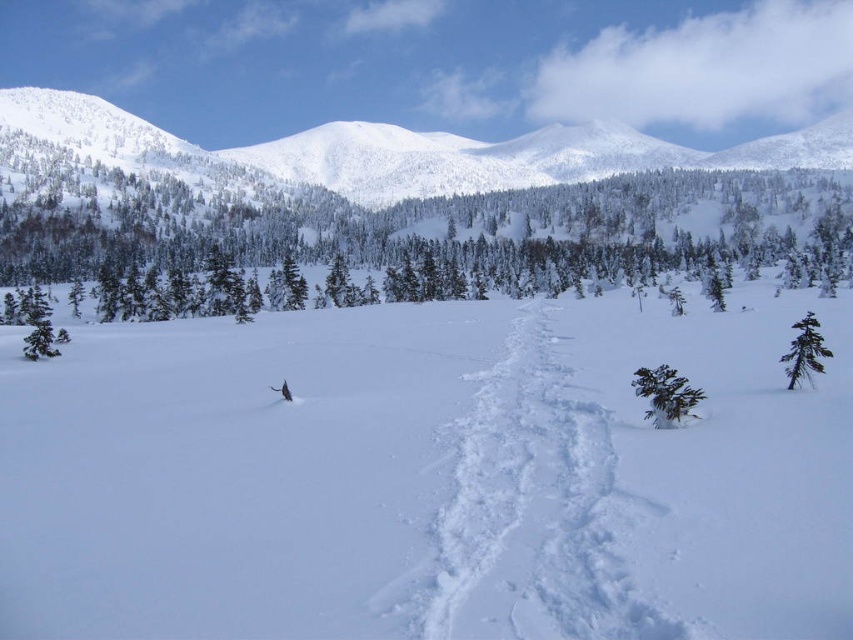
You are an explorer navigating through the winter landscape. You see a green textured tree at upper left and a green matte tree at center. Which tree is closer to you?

The green textured tree at upper left is closer to you because it is in front of the green matte tree at center.

You are an outdoor enthusiast planning a hiking route through the winter landscape. You see the green textured tree at upper left and the green matte tree at left. Which tree would you encounter first if you follow the trail of footprints towards the forest?

The green textured tree at upper left would be encountered first because the green matte tree at left is positioned behind it, meaning the textured tree is closer to the trail.